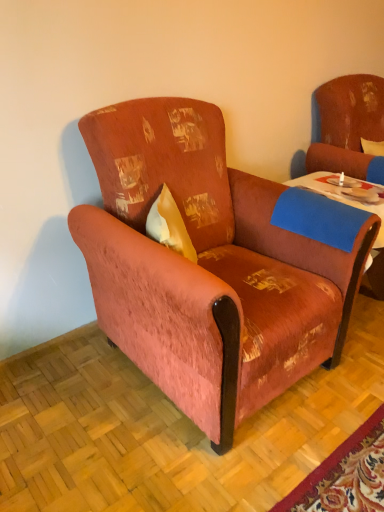
Where is `velvet-like rust-colored armchair at center`? velvet-like rust-colored armchair at center is located at coordinates (207, 267).

Describe the element at coordinates (207, 267) in the screenshot. This screenshot has height=512, width=384. I see `velvet-like rust-colored armchair at center` at that location.

The height and width of the screenshot is (512, 384). What are the coordinates of `distressed fabric swivel chair at upper right` in the screenshot? It's located at [347, 126].

Are blue felt table at center and velvet-like rust-colored armchair at center located far from each other?

No, blue felt table at center is not far away from velvet-like rust-colored armchair at center.

Considering the relative sizes of blue felt table at center and velvet-like rust-colored armchair at center in the image provided, is blue felt table at center taller than velvet-like rust-colored armchair at center?

No.

How much distance is there between blue felt table at center and velvet-like rust-colored armchair at center?

blue felt table at center is 21.78 inches away from velvet-like rust-colored armchair at center.

Could you tell me if blue felt table at center is facing velvet-like rust-colored armchair at center?

No, blue felt table at center is not oriented towards velvet-like rust-colored armchair at center.

Does distressed fabric swivel chair at upper right have a greater width compared to velvet-like rust-colored armchair at center?

Incorrect, the width of distressed fabric swivel chair at upper right does not surpass that of velvet-like rust-colored armchair at center.

From a real-world perspective, is distressed fabric swivel chair at upper right under velvet-like rust-colored armchair at center?

Actually, distressed fabric swivel chair at upper right is physically above velvet-like rust-colored armchair at center in the real world.

Between distressed fabric swivel chair at upper right and velvet-like rust-colored armchair at center, which one appears on the left side from the viewer's perspective?

Positioned to the left is velvet-like rust-colored armchair at center.

Is velvet-like rust-colored armchair at center surrounding blue felt table at center?

No, velvet-like rust-colored armchair at center does not contain blue felt table at center.

From a real-world perspective, which object stands above the other?

From a 3D spatial view, velvet-like rust-colored armchair at center is above.

Which is in front, point (301, 297) or point (381, 225)?

The point (301, 297) is in front.

Based on their sizes in the image, would you say velvet-like rust-colored armchair at center is bigger or smaller than blue felt table at center?

Clearly, velvet-like rust-colored armchair at center is larger in size than blue felt table at center.

Identify the location of table below the distressed fabric swivel chair at upper right (from a real-world perspective). The height and width of the screenshot is (512, 384). (339, 197).

Which object is positioned more to the right, blue felt table at center or distressed fabric swivel chair at upper right?

distressed fabric swivel chair at upper right is more to the right.

Can you confirm if blue felt table at center is taller than distressed fabric swivel chair at upper right?

No.

From the picture: From the image's perspective, which is above, blue felt table at center or distressed fabric swivel chair at upper right?

distressed fabric swivel chair at upper right appears higher in the image.

Is velvet-like rust-colored armchair at center further to the viewer compared to distressed fabric swivel chair at upper right?

No, it is not.

I want to click on swivel chair above the velvet-like rust-colored armchair at center (from a real-world perspective), so click(x=347, y=126).

How many degrees apart are the facing directions of velvet-like rust-colored armchair at center and distressed fabric swivel chair at upper right?

The angle between the facing direction of velvet-like rust-colored armchair at center and the facing direction of distressed fabric swivel chair at upper right is 0.000551 degrees.

Considering the relative positions of velvet-like rust-colored armchair at center and distressed fabric swivel chair at upper right in the image provided, is velvet-like rust-colored armchair at center to the left of distressed fabric swivel chair at upper right from the viewer's perspective?

Correct, you'll find velvet-like rust-colored armchair at center to the left of distressed fabric swivel chair at upper right.

From a real-world perspective, is distressed fabric swivel chair at upper right located higher than blue felt table at center?

Yes, from a real-world perspective, distressed fabric swivel chair at upper right is above blue felt table at center.

Does point (362, 151) lie in front of point (312, 180)?

No, it is not.

Looking at this image, relative to blue felt table at center, is distressed fabric swivel chair at upper right in front or behind?

In the image, distressed fabric swivel chair at upper right appears behind blue felt table at center.

Where is `chair located in front of the blue felt table at center`? This screenshot has height=512, width=384. chair located in front of the blue felt table at center is located at coordinates (207, 267).

Locate an element on the screen. swivel chair lying on the right of velvet-like rust-colored armchair at center is located at coordinates (347, 126).

Based on their spatial positions, is distressed fabric swivel chair at upper right or blue felt table at center closer to velvet-like rust-colored armchair at center?

Based on the image, blue felt table at center appears to be nearer to velvet-like rust-colored armchair at center.

Looking at the image, which one is located closer to distressed fabric swivel chair at upper right, blue felt table at center or velvet-like rust-colored armchair at center?

Based on the image, blue felt table at center appears to be nearer to distressed fabric swivel chair at upper right.

Looking at the image, which one is located further to distressed fabric swivel chair at upper right, velvet-like rust-colored armchair at center or blue felt table at center?

Based on the image, velvet-like rust-colored armchair at center appears to be further to distressed fabric swivel chair at upper right.

Considering their positions, is velvet-like rust-colored armchair at center positioned closer to blue felt table at center than distressed fabric swivel chair at upper right?

distressed fabric swivel chair at upper right is positioned closer to the anchor blue felt table at center.

Which object lies nearer to the anchor point blue felt table at center, distressed fabric swivel chair at upper right or velvet-like rust-colored armchair at center?

distressed fabric swivel chair at upper right.

Estimate the real-world distances between objects in this image. Which object is closer to velvet-like rust-colored armchair at center, blue felt table at center or distressed fabric swivel chair at upper right?

Based on the image, blue felt table at center appears to be nearer to velvet-like rust-colored armchair at center.

This screenshot has height=512, width=384. I want to click on table located between velvet-like rust-colored armchair at center and distressed fabric swivel chair at upper right in the depth direction, so click(x=339, y=197).